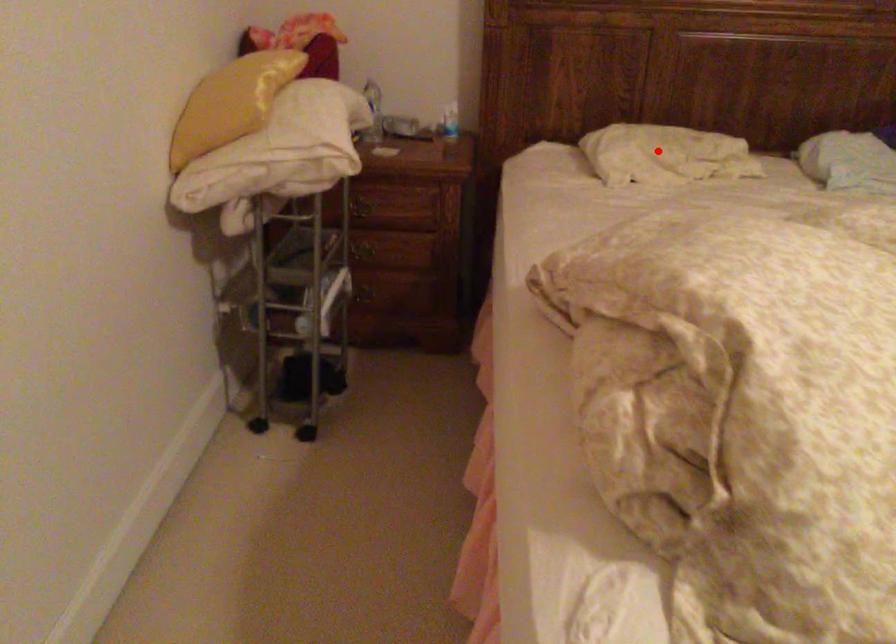
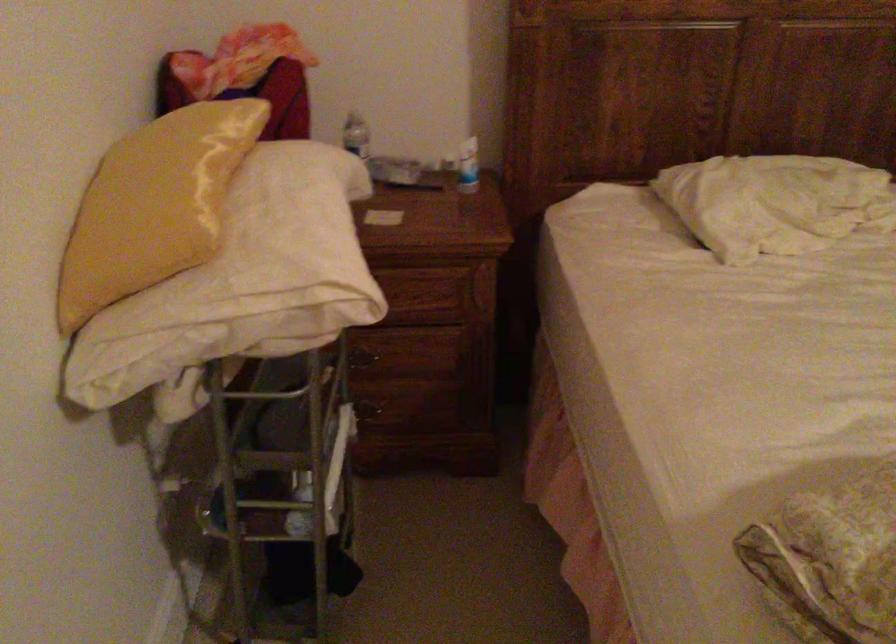
Find the pixel in the second image that matches the highlighted location in the first image.

(774, 202)